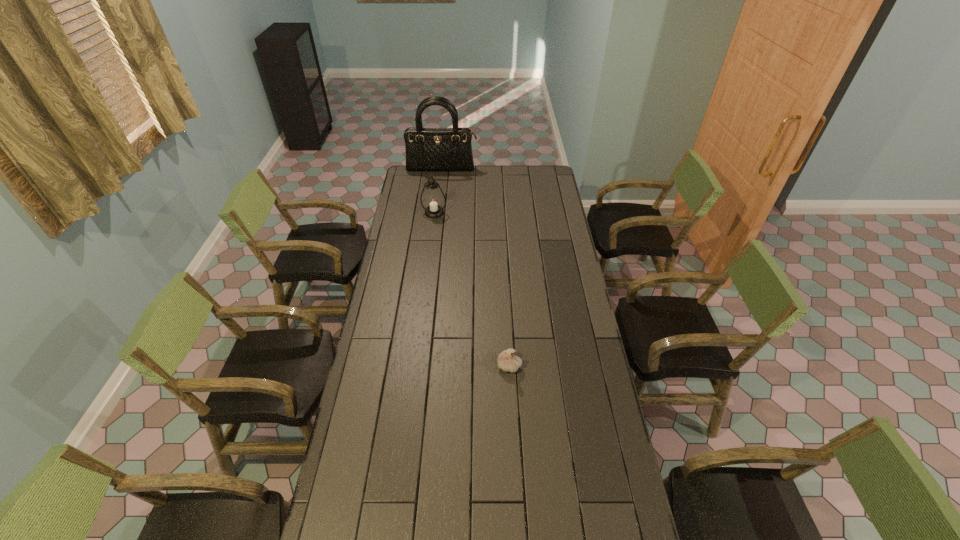
At what (x,y) coordinates should I click in order to perform the action: click on the farthest object. Please return your answer as a coordinate pair (x, y). The image size is (960, 540). Looking at the image, I should click on (446, 149).

Where is `handbag`? The image size is (960, 540). handbag is located at coordinates (446, 149).

Locate an element on the screen. The image size is (960, 540). oil lamp is located at coordinates (433, 200).

At what (x,y) coordinates should I click in order to perform the action: click on the second tallest object. Please return your answer as a coordinate pair (x, y). The width and height of the screenshot is (960, 540). Looking at the image, I should click on (433, 200).

Where is `the rightmost object`? This screenshot has height=540, width=960. the rightmost object is located at coordinates (507, 360).

Locate an element on the screen. the shortest object is located at coordinates (507, 360).

The width and height of the screenshot is (960, 540). Identify the location of vacant position located with an open clasp on the front of the farthest object. (438, 201).

Find the location of a particular element. This screenshot has width=960, height=540. vacant space located 0.230m on the right of the oil lamp is located at coordinates (489, 213).

Image resolution: width=960 pixels, height=540 pixels. I want to click on free space located on the left of the rightmost object, so click(x=399, y=366).

Locate an element on the screen. The width and height of the screenshot is (960, 540). object located at the far edge is located at coordinates (446, 149).